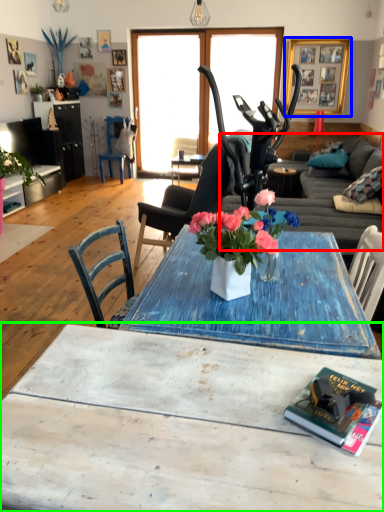
Question: Estimate the real-world distances between objects in this image. Which object is farther from studio couch (highlighted by a red box), picture frame (highlighted by a blue box) or coffee table (highlighted by a green box)?

Choices:
 (A) picture frame
 (B) coffee table

Answer: (B)